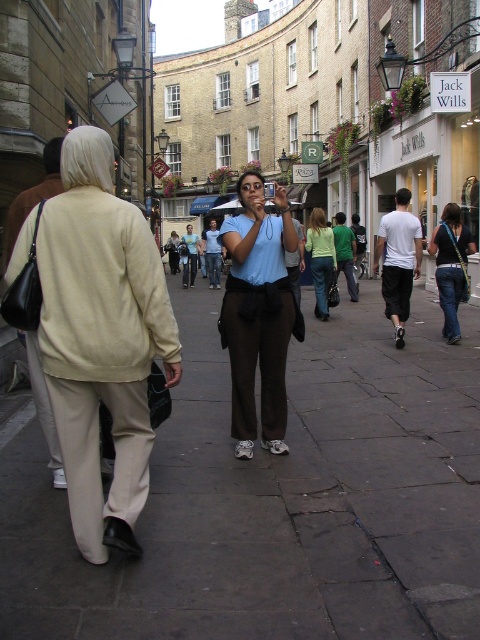
Is matte blue shirt at center to the left of denim jeans at center from the viewer's perspective?

Yes, matte blue shirt at center is to the left of denim jeans at center.

The height and width of the screenshot is (640, 480). In order to click on matte blue shirt at center in this screenshot , I will do `click(257, 314)`.

Does beige fabric jacket at left come in front of light blue shirt at center?

Yes, it is.

Is beige fabric jacket at left thinner than light blue shirt at center?

Yes, beige fabric jacket at left is thinner than light blue shirt at center.

Is point (117, 356) behind point (309, 232)?

That is False.

I want to click on beige fabric jacket at left, so click(100, 339).

Who is more forward, (257,513) or (442,304)?

Point (257,513) is in front.

Is point (288, 566) positioned in front of point (458, 259)?

That is True.

Based on the photo, who is more forward, (460,529) or (452,225)?

Point (460,529) is more forward.

Locate an element on the screen. The width and height of the screenshot is (480, 640). dark gray stone pavement at center is located at coordinates (278, 499).